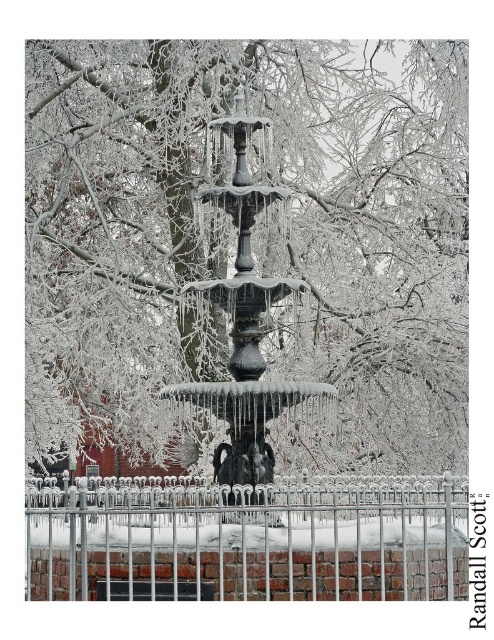
Question: Estimate the real-world distances between objects in this image. Which object is farther from the white metal fence at lower center?

Choices:
 (A) white frosted branches at center
 (B) polished bronze fountain at center

Answer: (A)

Question: Can you confirm if white frosted branches at center is bigger than polished bronze fountain at center?

Choices:
 (A) yes
 (B) no

Answer: (A)

Question: Which point appears farthest from the camera in this image?

Choices:
 (A) (272, 451)
 (B) (256, 97)

Answer: (B)

Question: Can you confirm if white metal fence at lower center is wider than polished bronze fountain at center?

Choices:
 (A) no
 (B) yes

Answer: (B)

Question: Which of these objects is positioned farthest from the white frosted branches at center?

Choices:
 (A) polished bronze fountain at center
 (B) white metal fence at lower center

Answer: (B)

Question: Does white frosted branches at center have a larger size compared to polished bronze fountain at center?

Choices:
 (A) yes
 (B) no

Answer: (A)